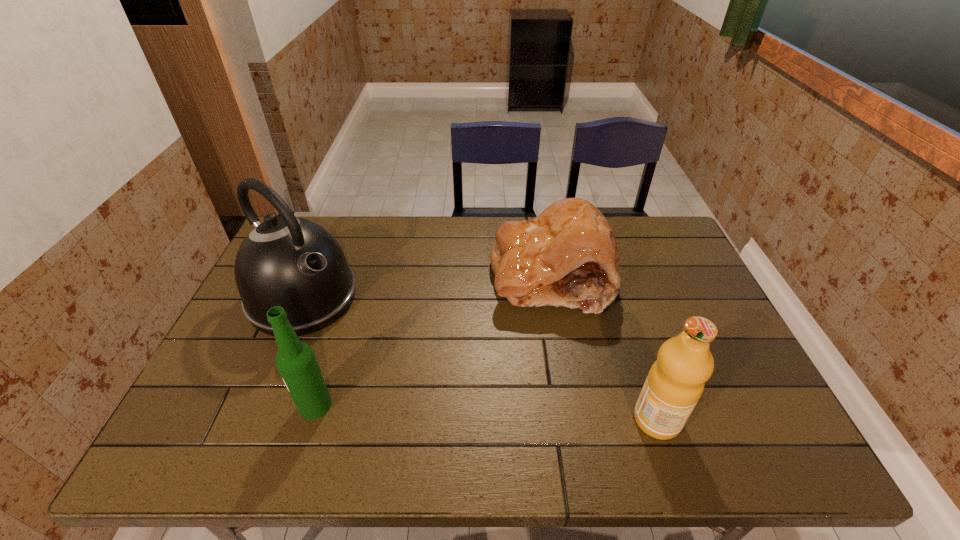
Identify the location of beer bottle. The height and width of the screenshot is (540, 960). (296, 362).

Find the location of a particular element. This screenshot has width=960, height=540. fruit juice is located at coordinates (675, 382).

The height and width of the screenshot is (540, 960). What are the coordinates of `the shortest object` in the screenshot? It's located at (567, 256).

Locate an element on the screen. the tallest object is located at coordinates (291, 262).

Identify the location of free space located 0.060m on the label of the beer bottle. Image resolution: width=960 pixels, height=540 pixels. (274, 405).

This screenshot has height=540, width=960. I want to click on free space located 0.150m on the label of the beer bottle, so click(x=234, y=405).

Locate an element on the screen. This screenshot has height=540, width=960. vacant space located 0.140m on the label of the beer bottle is located at coordinates (239, 405).

At what (x,y) coordinates should I click in order to perform the action: click on vacant space located 0.080m on the front label of the fruit juice. Please return your answer as a coordinate pair (x, y). Looking at the image, I should click on (715, 420).

Image resolution: width=960 pixels, height=540 pixels. Find the location of `free space located 0.090m on the filling side of the shortest object`. free space located 0.090m on the filling side of the shortest object is located at coordinates (506, 332).

Locate an element on the screen. The image size is (960, 540). free space located 0.150m on the filling side of the shortest object is located at coordinates (494, 347).